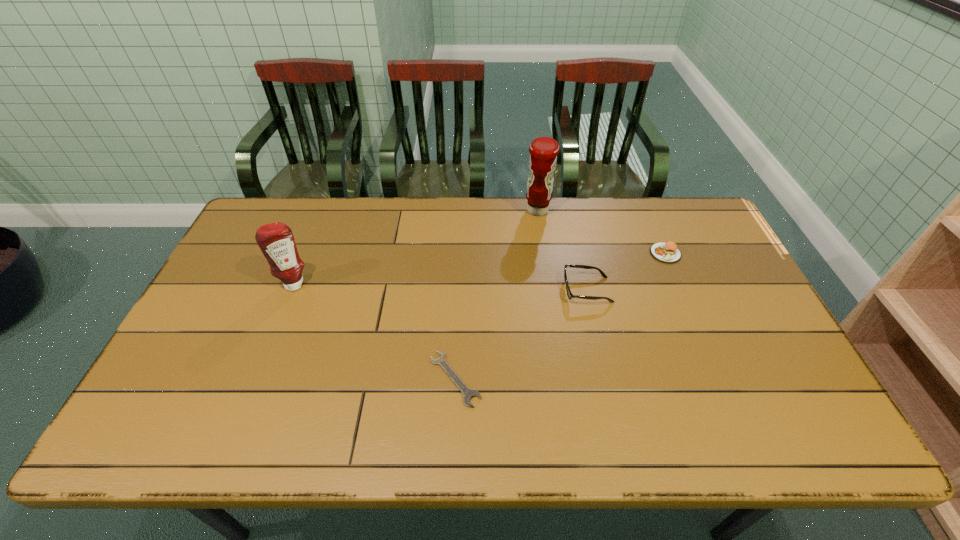
You are a GUI agent. You are given a task and a screenshot of the screen. Output one action in this format:
    pyautogui.click(x=<x>, y=<y>)
    Task: Click on the free location at the left edge of the desktop
    The width and height of the screenshot is (960, 540).
    Given the screenshot: What is the action you would take?
    pyautogui.click(x=180, y=374)

This screenshot has width=960, height=540. Find the location of `vacant area at the right edge`. vacant area at the right edge is located at coordinates click(694, 249).

In the image, there is a desktop. Identify the location of free space at the far left corner. 284,224.

I want to click on free spot at the near left corner of the desktop, so click(179, 443).

This screenshot has width=960, height=540. What are the coordinates of `vacant space at the far right corner of the desktop` in the screenshot? It's located at (668, 211).

I want to click on vacant space at the near right corner of the desktop, so click(x=808, y=449).

At what (x,y) coordinates should I click in order to perform the action: click on free space between the patty and the third tallest object. Please return your answer as a coordinate pair (x, y). The width and height of the screenshot is (960, 540). Looking at the image, I should click on (626, 272).

You are a GUI agent. You are given a task and a screenshot of the screen. Output one action in this format:
    pyautogui.click(x=<x>, y=<y>)
    Task: Click on the free area in between the nearest object and the second tallest object
    The height and width of the screenshot is (540, 960).
    Given the screenshot: What is the action you would take?
    pyautogui.click(x=374, y=332)

Image resolution: width=960 pixels, height=540 pixels. Find the location of `unoccupied area between the second shortest object and the third shortest object`. unoccupied area between the second shortest object and the third shortest object is located at coordinates (626, 272).

I want to click on vacant area that lies between the third shortest object and the left condiment, so click(x=441, y=287).